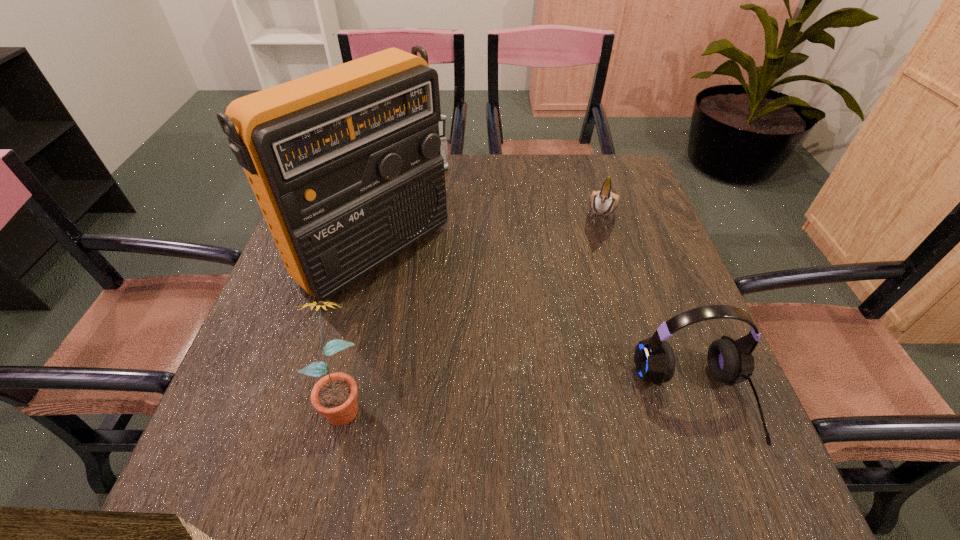
Locate an element on the screen. bird positioned at the right edge is located at coordinates (603, 202).

The height and width of the screenshot is (540, 960). What are the coordinates of `object that is at the far right corner` in the screenshot? It's located at (603, 202).

You are a GUI agent. You are given a task and a screenshot of the screen. Output one action in this format:
    pyautogui.click(x=<x>, y=<y>)
    Task: Click on the object located in the near right corner section of the desktop
    
    Given the screenshot: What is the action you would take?
    pyautogui.click(x=730, y=361)

The width and height of the screenshot is (960, 540). I want to click on free space at the far edge of the desktop, so [473, 191].

Find the location of a particular element. This screenshot has width=960, height=540. vacant space at the near edge of the desktop is located at coordinates (406, 437).

At what (x,y) coordinates should I click in order to perform the action: click on blank space at the left edge of the desktop. Please return your answer as a coordinate pair (x, y). Looking at the image, I should click on (280, 363).

This screenshot has width=960, height=540. In order to click on vacant space at the right edge in this screenshot , I will do `click(640, 299)`.

In the image, there is a desktop. Where is `free space at the near left corner`? This screenshot has height=540, width=960. free space at the near left corner is located at coordinates coord(302,396).

You are a GUI agent. You are given a task and a screenshot of the screen. Output one action in this format:
    pyautogui.click(x=<x>, y=<y>)
    Task: Click on the vacant space at the far right corner of the desktop
    Image resolution: width=960 pixels, height=540 pixels.
    Given the screenshot: What is the action you would take?
    pyautogui.click(x=613, y=186)

This screenshot has width=960, height=540. In order to click on free space at the near right corner of the desktop in this screenshot , I will do `click(741, 415)`.